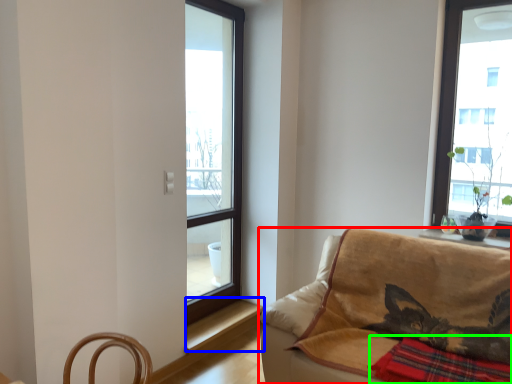
Question: Which object is positioned farthest from studio couch (highlighted by a red box)? Select from window sill (highlighted by a blue box) and plaid (highlighted by a green box).

Choices:
 (A) window sill
 (B) plaid

Answer: (A)